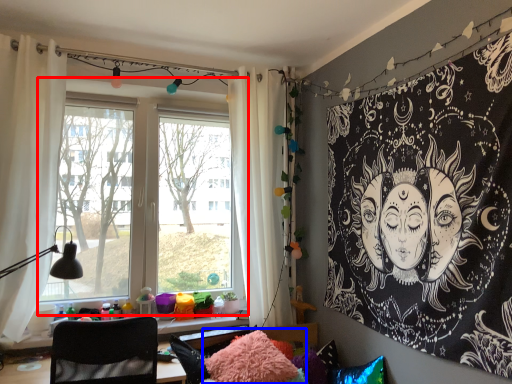
Question: Which of the following is the farthest to the observer, window (highlighted by a red box) or pillow (highlighted by a blue box)?

Choices:
 (A) window
 (B) pillow

Answer: (A)